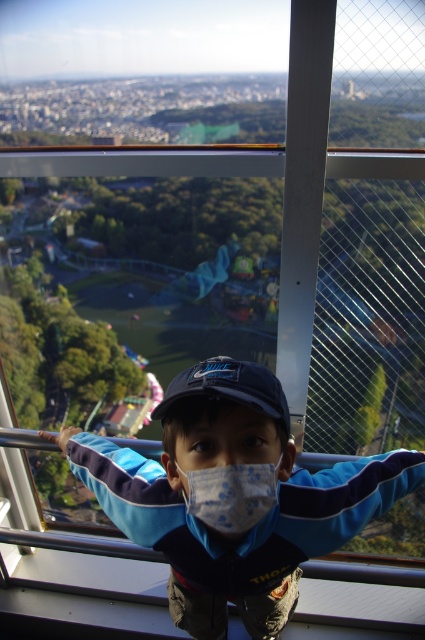
Is blue fabric jacket at center positioned behind blue fabric mask at center?

Yes, blue fabric jacket at center is further from the viewer.

Can you confirm if blue fabric jacket at center is positioned to the right of blue fabric mask at center?

Indeed, blue fabric jacket at center is positioned on the right side of blue fabric mask at center.

Consider the image. Who is more forward, (204, 513) or (240, 480)?

Point (240, 480)

Find the location of `blue fabric jacket at center`. blue fabric jacket at center is located at coordinates (234, 497).

Between blue fabric mask at center and navy blue fabric baseball cap at center, which one has more height?

navy blue fabric baseball cap at center is taller.

Based on the photo, is blue fabric mask at center smaller than navy blue fabric baseball cap at center?

Correct, blue fabric mask at center occupies less space than navy blue fabric baseball cap at center.

Locate an element on the screen. blue fabric mask at center is located at coordinates (231, 493).

Who is more forward, (362, 477) or (282, 410)?

Point (282, 410)

How much distance is there between blue fabric jacket at center and navy blue fabric baseball cap at center?

blue fabric jacket at center and navy blue fabric baseball cap at center are 15.13 inches apart from each other.

Does point (218, 573) lie behind point (198, 396)?

That is True.

This screenshot has height=640, width=425. I want to click on blue fabric jacket at center, so click(x=234, y=497).